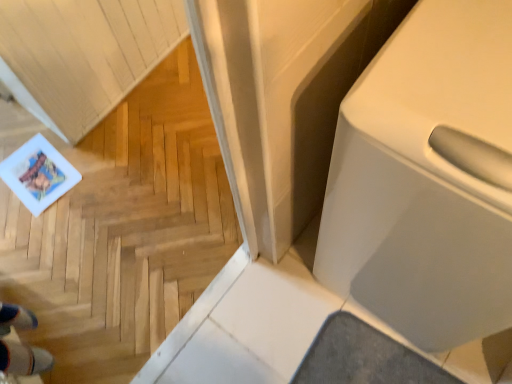
Where is `white glossy toilet at right`? white glossy toilet at right is located at coordinates (426, 178).

What do you see at coordinates (426, 178) in the screenshot? I see `white glossy toilet at right` at bounding box center [426, 178].

Measure the distance between light wood parquet floor at lower left and camera.

light wood parquet floor at lower left is 1.21 meters away from camera.

Identify the location of light wood parquet floor at lower left. This screenshot has height=384, width=512. (124, 231).

What do you see at coordinates (124, 231) in the screenshot? This screenshot has width=512, height=384. I see `light wood parquet floor at lower left` at bounding box center [124, 231].

The height and width of the screenshot is (384, 512). In order to click on white glossy toilet at right in this screenshot , I will do `click(426, 178)`.

Considering the relative positions of white glossy toilet at right and light wood parquet floor at lower left in the image provided, is white glossy toilet at right to the left or to the right of light wood parquet floor at lower left?

Based on their positions, white glossy toilet at right is located to the right of light wood parquet floor at lower left.

Which object is closer to the camera, white glossy toilet at right or light wood parquet floor at lower left?

light wood parquet floor at lower left is closer to the camera.

Considering the points (468, 170) and (95, 205), which point is behind, point (468, 170) or point (95, 205)?

The point (95, 205) is behind.

From the image's perspective, is white glossy toilet at right located above or below light wood parquet floor at lower left?

Clearly, from the image's perspective, white glossy toilet at right is above light wood parquet floor at lower left.

From a real-world perspective, which is physically below, white glossy toilet at right or light wood parquet floor at lower left?

From a 3D spatial view, white glossy toilet at right is below.

Is white glossy toilet at right thinner than light wood parquet floor at lower left?

Incorrect, the width of white glossy toilet at right is not less than that of light wood parquet floor at lower left.

Can you confirm if white glossy toilet at right is shorter than light wood parquet floor at lower left?

Correct, white glossy toilet at right is not as tall as light wood parquet floor at lower left.

Between white glossy toilet at right and light wood parquet floor at lower left, which one has smaller size?

light wood parquet floor at lower left is smaller.

Which is correct: white glossy toilet at right is inside light wood parquet floor at lower left, or outside of it?

white glossy toilet at right is not inside light wood parquet floor at lower left, it's outside.

Is white glossy toilet at right directly adjacent to light wood parquet floor at lower left?

No, white glossy toilet at right is not with light wood parquet floor at lower left.

Is white glossy toilet at right aimed at light wood parquet floor at lower left?

No, white glossy toilet at right is not turned towards light wood parquet floor at lower left.

I want to click on home appliance that appears behind the light wood parquet floor at lower left, so click(426, 178).

Is light wood parquet floor at lower left to the left of white glossy toilet at right from the viewer's perspective?

Indeed, light wood parquet floor at lower left is positioned on the left side of white glossy toilet at right.

Is light wood parquet floor at lower left positioned before white glossy toilet at right?

That is True.

Considering the points (193, 249) and (400, 260), which point is in front, point (193, 249) or point (400, 260)?

The point (400, 260) is closer.

From the image's perspective, would you say light wood parquet floor at lower left is shown under white glossy toilet at right?

Yes, from the image's perspective, light wood parquet floor at lower left is beneath white glossy toilet at right.

Looking at this image, from a real-world perspective, is light wood parquet floor at lower left positioned under white glossy toilet at right based on gravity?

No.

Can you confirm if light wood parquet floor at lower left is wider than white glossy toilet at right?

Incorrect, the width of light wood parquet floor at lower left does not surpass that of white glossy toilet at right.

Who is taller, light wood parquet floor at lower left or white glossy toilet at right?

light wood parquet floor at lower left.

Considering the relative sizes of light wood parquet floor at lower left and white glossy toilet at right in the image provided, is light wood parquet floor at lower left bigger than white glossy toilet at right?

Actually, light wood parquet floor at lower left might be smaller than white glossy toilet at right.

Is light wood parquet floor at lower left inside or outside of white glossy toilet at right?

light wood parquet floor at lower left is not enclosed by white glossy toilet at right.

Are light wood parquet floor at lower left and white glossy toilet at right far apart?

That's not correct — light wood parquet floor at lower left is a little close to white glossy toilet at right.

Is light wood parquet floor at lower left oriented towards white glossy toilet at right?

No.

At what (x,y) coordinates should I click in order to perform the action: click on home appliance above the light wood parquet floor at lower left (from the image's perspective). Please return your answer as a coordinate pair (x, y). This screenshot has width=512, height=384. Looking at the image, I should click on (426, 178).

The width and height of the screenshot is (512, 384). Find the location of `home appliance that is above the light wood parquet floor at lower left (from the image's perspective)`. home appliance that is above the light wood parquet floor at lower left (from the image's perspective) is located at coordinates (426, 178).

Locate an element on the screen. This screenshot has width=512, height=384. home appliance below the light wood parquet floor at lower left (from a real-world perspective) is located at coordinates (426, 178).